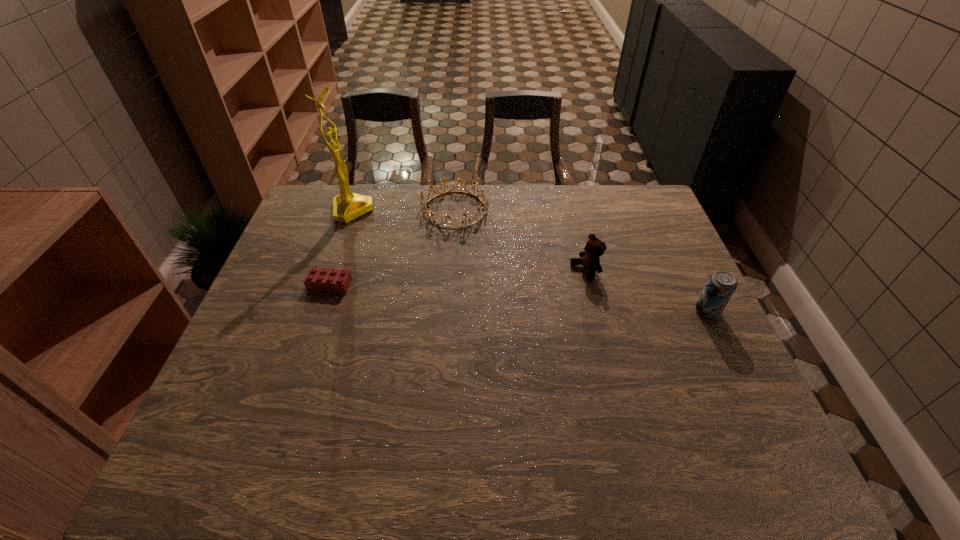
Locate an element on the screen. object that is the third closest to the tallest object is located at coordinates [594, 248].

Where is `vacant area that satisfies the following two spatial constraints: 1. on the back side of the award; 2. on the left side of the third object from right to left`? The image size is (960, 540). vacant area that satisfies the following two spatial constraints: 1. on the back side of the award; 2. on the left side of the third object from right to left is located at coordinates (353, 210).

Where is `vacant area that satisfies the following two spatial constraints: 1. on the front side of the fourth object from left to right; 2. on the left side of the beer can`? The image size is (960, 540). vacant area that satisfies the following two spatial constraints: 1. on the front side of the fourth object from left to right; 2. on the left side of the beer can is located at coordinates (595, 312).